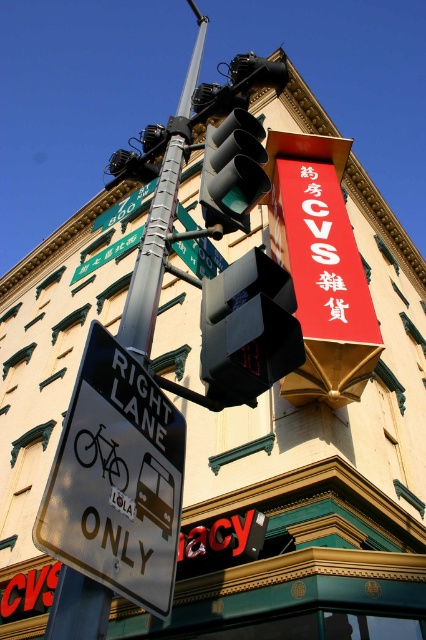
Question: Can you confirm if metallic silver sign at right is smaller than green matte traffic light at upper center?

Choices:
 (A) no
 (B) yes

Answer: (A)

Question: Is green matte traffic light at upper center to the right of white plastic sign at upper left from the viewer's perspective?

Choices:
 (A) no
 (B) yes

Answer: (B)

Question: Estimate the real-world distances between objects in this image. Which object is closer to the metallic pole at left?

Choices:
 (A) metallic silver sign at right
 (B) green plastic street sign at upper left
 (C) metallic silver traffic light at upper center
 (D) black plastic traffic light at center

Answer: (A)

Question: Considering the relative positions of metallic silver sign at right and green metal street sign at upper center in the image provided, where is metallic silver sign at right located with respect to green metal street sign at upper center?

Choices:
 (A) above
 (B) below

Answer: (B)

Question: Which object is closer to the camera taking this photo?

Choices:
 (A) metallic pole at left
 (B) white plastic sign at upper left
 (C) green matte traffic light at upper center
 (D) green metal street sign at upper center

Answer: (A)

Question: Which of the following is the closest to the observer?

Choices:
 (A) black plastic traffic light at center
 (B) metallic silver traffic light at upper center
 (C) white plastic sign at upper left
 (D) metallic pole at left

Answer: (D)